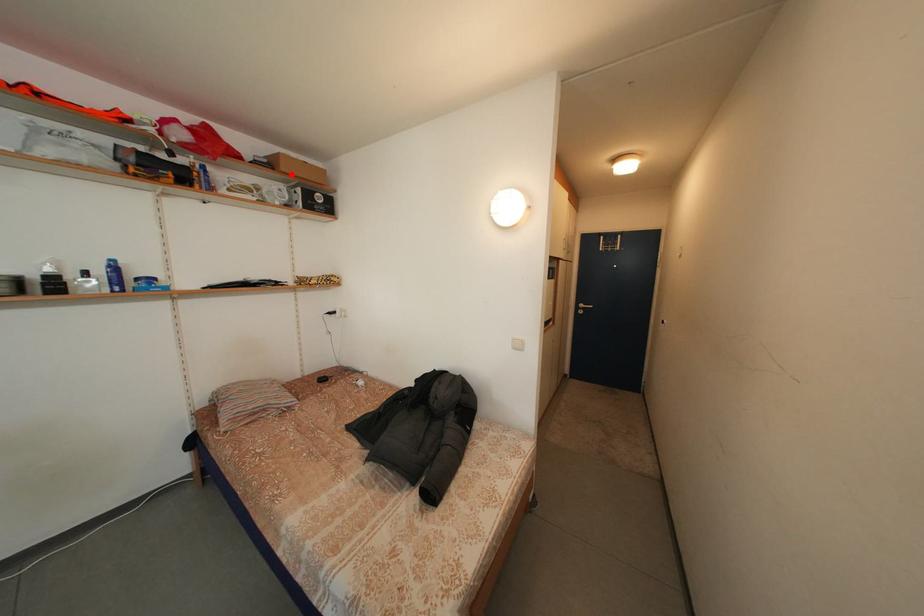
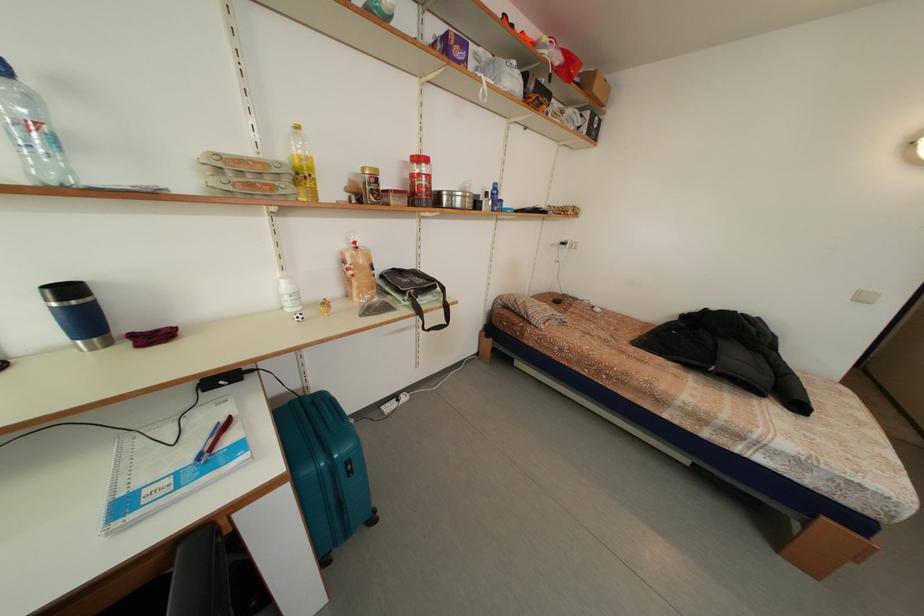
Locate, in the second image, the point that corresponds to the highlighted location in the first image.

(603, 95)